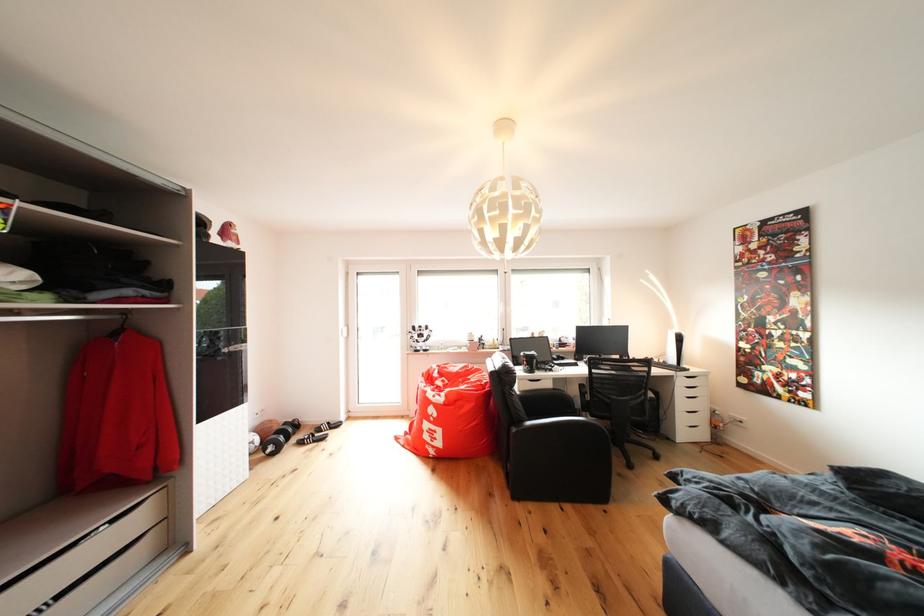
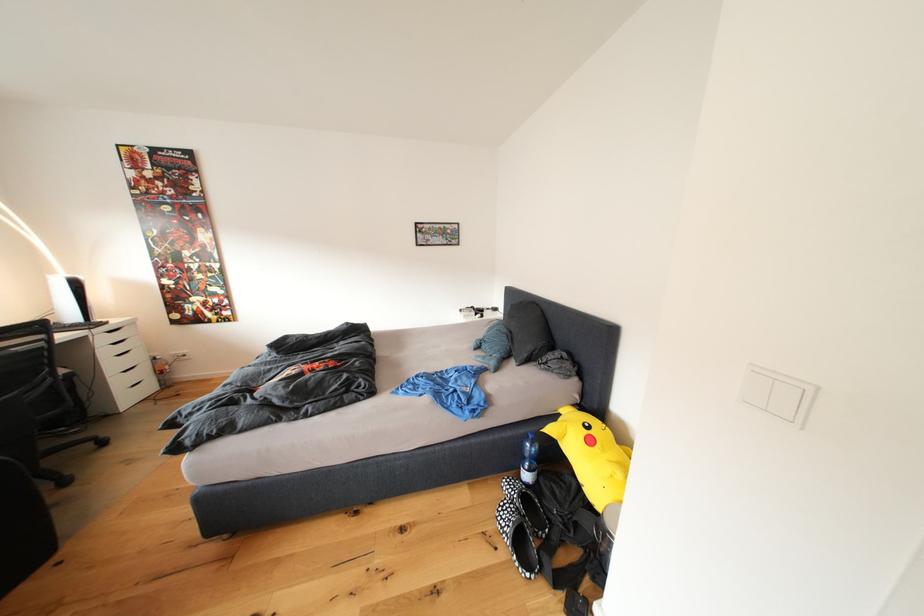
In the second image, find the point that corresponds to (x=689, y=387) in the first image.

(111, 344)